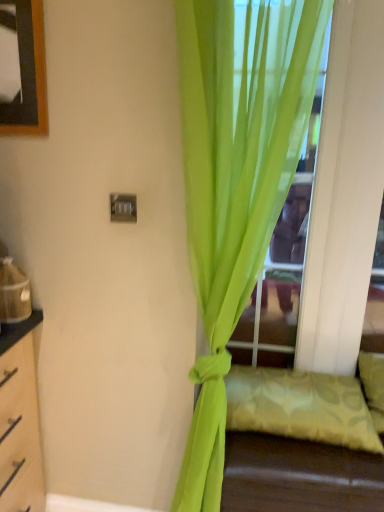
Question: Considering the relative sizes of light green fabric pillow at lower right and transparent glass door at center in the image provided, is light green fabric pillow at lower right shorter than transparent glass door at center?

Choices:
 (A) no
 (B) yes

Answer: (B)

Question: Does light green fabric pillow at lower right appear on the left side of transparent glass door at center?

Choices:
 (A) no
 (B) yes

Answer: (A)

Question: From a real-world perspective, is light green fabric pillow at lower right positioned under transparent glass door at center based on gravity?

Choices:
 (A) no
 (B) yes

Answer: (B)

Question: From a real-world perspective, is light green fabric pillow at lower right on transparent glass door at center?

Choices:
 (A) yes
 (B) no

Answer: (B)

Question: Is transparent glass door at center completely or partially inside light green fabric pillow at lower right?

Choices:
 (A) no
 (B) yes

Answer: (A)

Question: Is lime green sheer curtain at center spatially inside transparent glass door at center, or outside of it?

Choices:
 (A) outside
 (B) inside

Answer: (A)

Question: Considering the relative positions of lime green sheer curtain at center and transparent glass door at center in the image provided, is lime green sheer curtain at center to the left or to the right of transparent glass door at center?

Choices:
 (A) left
 (B) right

Answer: (A)

Question: From the image's perspective, is lime green sheer curtain at center positioned above or below transparent glass door at center?

Choices:
 (A) below
 (B) above

Answer: (A)

Question: From a real-world perspective, is lime green sheer curtain at center positioned above or below transparent glass door at center?

Choices:
 (A) above
 (B) below

Answer: (B)

Question: In terms of height, does light green fabric pillow at lower right look taller or shorter compared to lime green sheer curtain at center?

Choices:
 (A) short
 (B) tall

Answer: (A)

Question: From a real-world perspective, is light green fabric pillow at lower right physically located above or below lime green sheer curtain at center?

Choices:
 (A) below
 (B) above

Answer: (A)

Question: Is point (307, 388) closer or farther from the camera than point (231, 113)?

Choices:
 (A) closer
 (B) farther

Answer: (B)

Question: From the image's perspective, is light green fabric pillow at lower right above or below lime green sheer curtain at center?

Choices:
 (A) above
 (B) below

Answer: (B)

Question: Relative to transparent glass door at center, is light green fabric pillow at lower right in front or behind?

Choices:
 (A) front
 (B) behind

Answer: (A)

Question: Considering the positions of light green fabric pillow at lower right and transparent glass door at center in the image, is light green fabric pillow at lower right bigger or smaller than transparent glass door at center?

Choices:
 (A) big
 (B) small

Answer: (B)